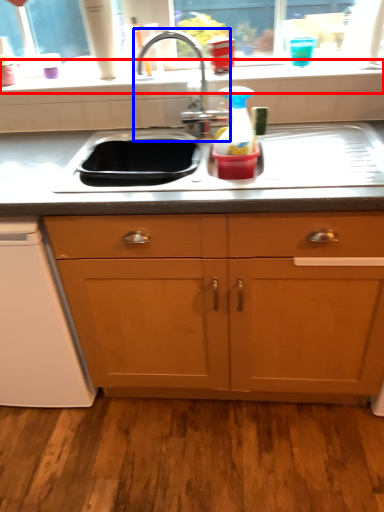
Question: Which object appears closest to the camera in this image, window sill (highlighted by a red box) or tap (highlighted by a blue box)?

Choices:
 (A) window sill
 (B) tap

Answer: (B)